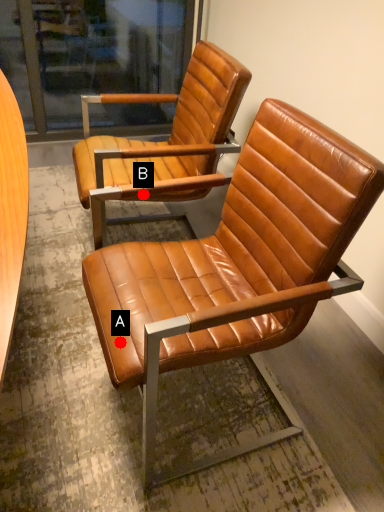
Question: Two points are circled on the image, labeled by A and B beside each circle. Among these points, which one is nearest to the camera?

Choices:
 (A) A is closer
 (B) B is closer

Answer: (A)